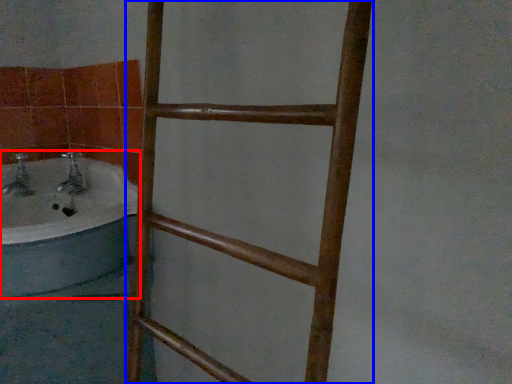
Question: Which of the following is the farthest to the observer, bathtub (highlighted by a red box) or ladder (highlighted by a blue box)?

Choices:
 (A) bathtub
 (B) ladder

Answer: (A)